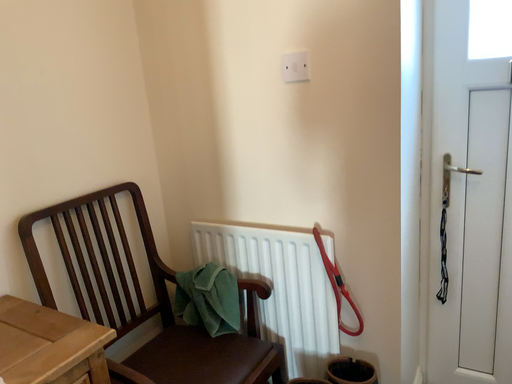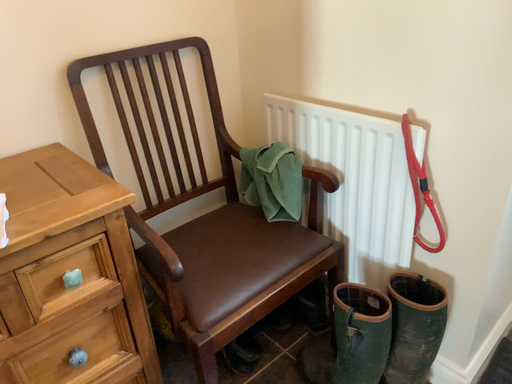
Question: Which way did the camera rotate in the video?

Choices:
 (A) rotated downward
 (B) rotated upward

Answer: (A)